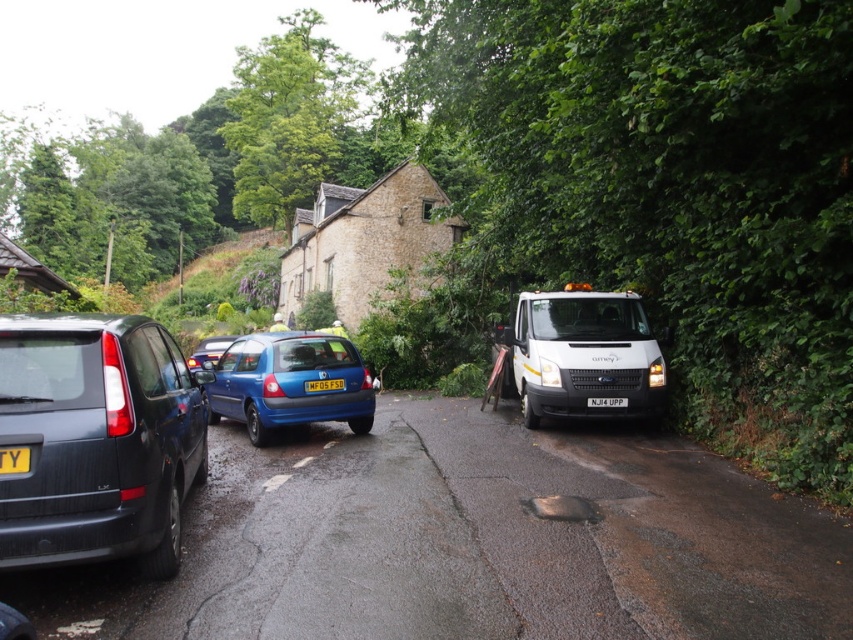
Question: Which of the following is the closest to the observer?

Choices:
 (A) black plastic license plate at center
 (B) matte black minivan at left

Answer: (B)

Question: Can you confirm if white glossy van at center is positioned below yellow plastic license plate at center?

Choices:
 (A) no
 (B) yes

Answer: (B)

Question: Does matte black minivan at left have a larger size compared to black plastic license plate at center?

Choices:
 (A) yes
 (B) no

Answer: (A)

Question: Which object is the closest to the white glossy van at center?

Choices:
 (A) dark gray asphalt driveway at center
 (B) matte black minivan at left
 (C) yellow plastic license plate at center
 (D) yellow matte license plate at center

Answer: (A)

Question: Which point is closer to the camera?

Choices:
 (A) (80, 323)
 (B) (0, 458)
 (C) (331, 387)

Answer: (B)

Question: Is matte black minivan at left further to the viewer compared to matte blue hatchback at center?

Choices:
 (A) no
 (B) yes

Answer: (A)